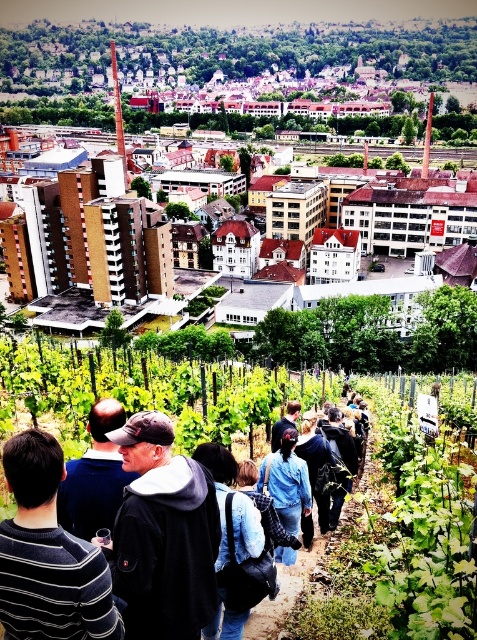
Question: Where is matte brown buildings at center located in relation to dark blue fabric at center in the image?

Choices:
 (A) right
 (B) left

Answer: (A)

Question: Which object is positioned closest to the dark blue fabric at center?

Choices:
 (A) denim jacket at center
 (B) black hoodie at center
 (C) striped sweater at lower left
 (D) matte brown buildings at center

Answer: (A)

Question: Is denim jacket at center to the left of dark blue fabric at center from the viewer's perspective?

Choices:
 (A) yes
 (B) no

Answer: (A)

Question: Which of the following is the closest to the observer?

Choices:
 (A) denim jacket at center
 (B) matte brown buildings at center
 (C) striped sweater at lower left
 (D) dark blue fabric at center

Answer: (C)

Question: Which object appears farthest from the camera in this image?

Choices:
 (A) dark blue fabric at center
 (B) striped sweater at lower left
 (C) black hoodie at center
 (D) denim jacket at center

Answer: (D)

Question: From the image, what is the correct spatial relationship of matte brown buildings at center in relation to dark gray hoodie at center?

Choices:
 (A) below
 (B) above

Answer: (B)